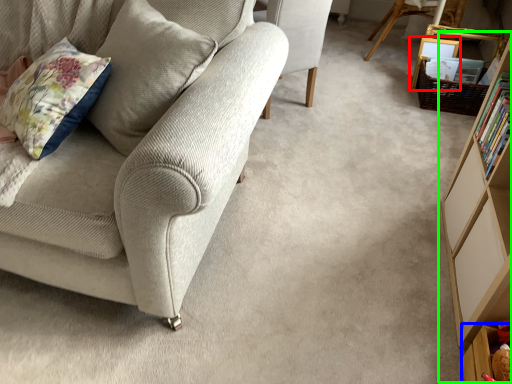
Question: Based on their relative distances, which object is farther from picture frame (highlighted by a red box)? Choose from shelf (highlighted by a blue box) and bookcase (highlighted by a green box).

Choices:
 (A) shelf
 (B) bookcase

Answer: (A)